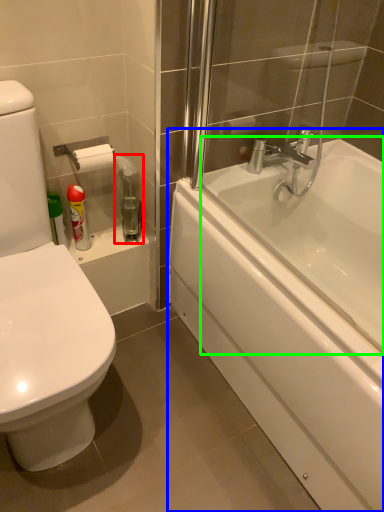
Question: Considering the real-world distances, which object is closest to cleaning product (highlighted by a red box)? bathtub (highlighted by a blue box) or bath (highlighted by a green box).

Choices:
 (A) bathtub
 (B) bath

Answer: (A)